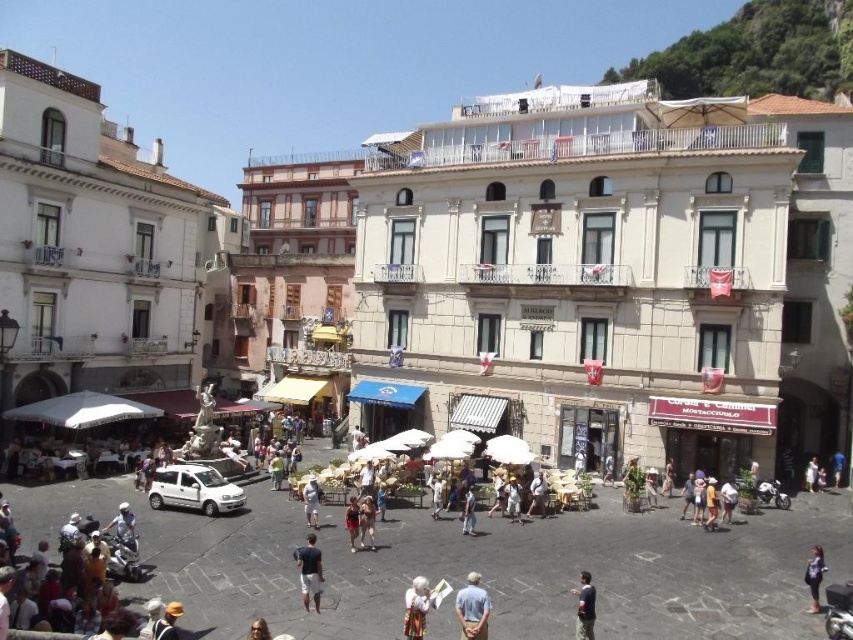
Question: Is light blue shirt at center thinner than light blue denim jeans at center?

Choices:
 (A) no
 (B) yes

Answer: (A)

Question: Is matte black dress at lower right bigger than light blue denim jeans at center?

Choices:
 (A) no
 (B) yes

Answer: (B)

Question: Which object is closer to the camera taking this photo?

Choices:
 (A) dark blue shirt at center
 (B) white fabric bag at lower center
 (C) light blue shirt at center
 (D) dark blue fabric shirt at center

Answer: (C)

Question: Which object appears closest to the camera in this image?

Choices:
 (A) light blue shirt at center
 (B) matte black dress at lower right

Answer: (A)

Question: Which object is the farthest from the matte black dress at lower right?

Choices:
 (A) light blue denim jeans at center
 (B) light brown leather shorts at center
 (C) white fabric bag at lower center
 (D) light blue shirt at center

Answer: (B)

Question: Considering the relative positions of light brown leather jacket at center and light brown leather shorts at center in the image provided, where is light brown leather jacket at center located with respect to light brown leather shorts at center?

Choices:
 (A) below
 (B) above

Answer: (B)